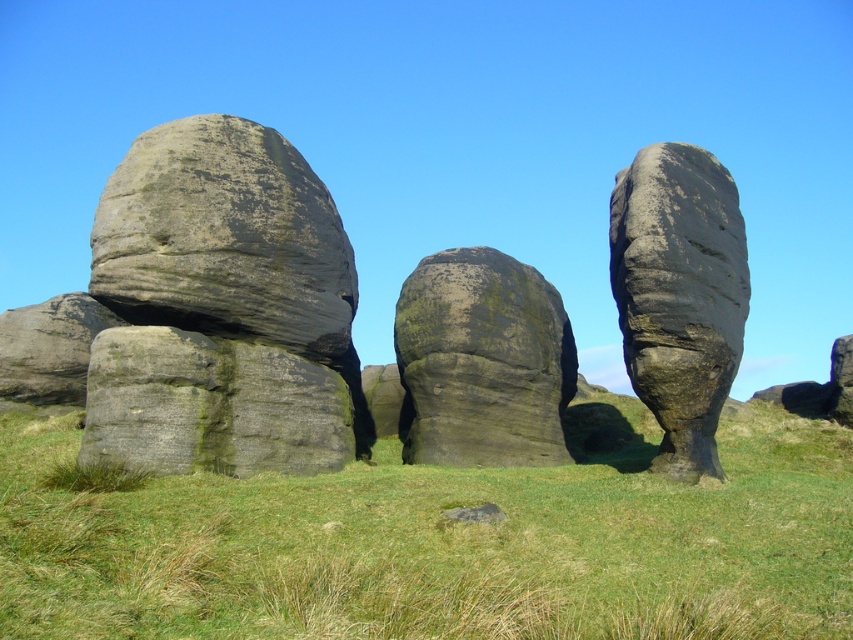
You are planning to place a small garden ornament that requires a 2 square feet area. You see the green grass at center and the rough gray rock at center. Which area would be suitable for placing the ornament?

The green grass at center has a larger width than the rough gray rock at center, so the green grass at center would be suitable for placing the ornament since it provides enough space.

In the scene shown: You are standing in the middle of the grassy field looking at the rock formations. There are two points marked on the ground. One is at point (782,506) and the other is at point (125,227). Which point is closer to you?

Point (782,506) is closer to the viewer than point (125,227).